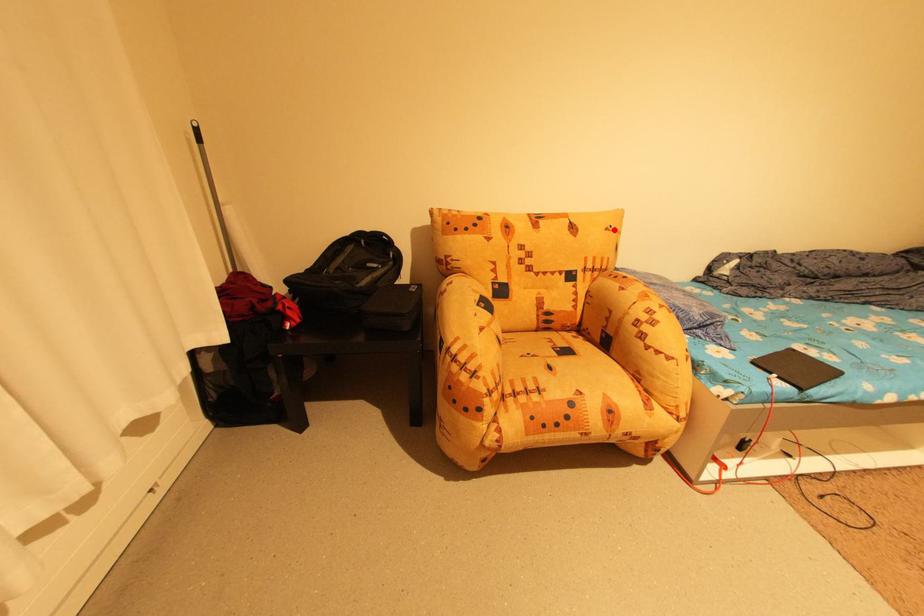
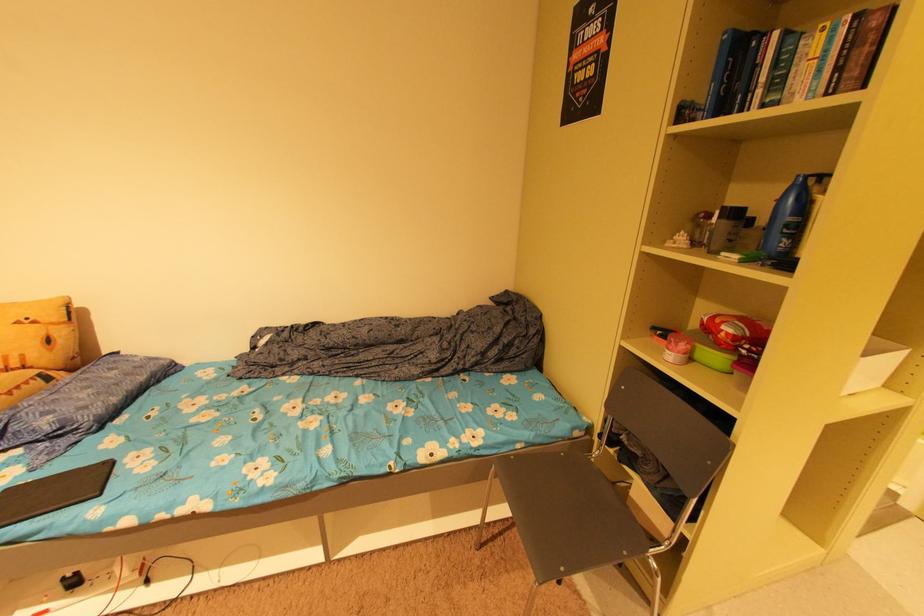
The point at the highlighted location is marked in the first image. Where is the corresponding point in the second image?

(23, 323)